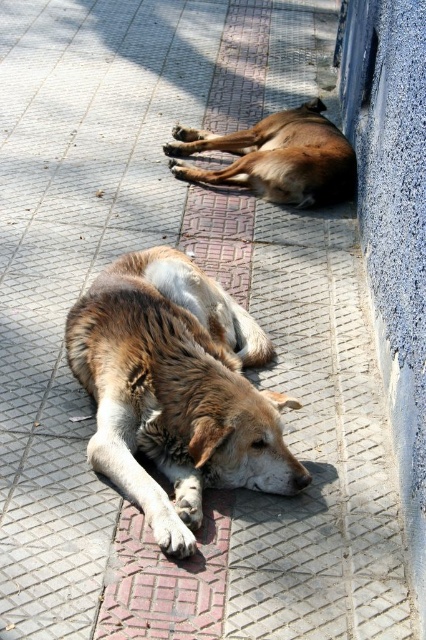
Question: Can you confirm if brown fur dog at center is thinner than brown furry dog at center?

Choices:
 (A) no
 (B) yes

Answer: (B)

Question: Is brown fur dog at center bigger than brown furry dog at center?

Choices:
 (A) no
 (B) yes

Answer: (B)

Question: Does brown fur dog at center have a smaller size compared to brown furry dog at center?

Choices:
 (A) no
 (B) yes

Answer: (A)